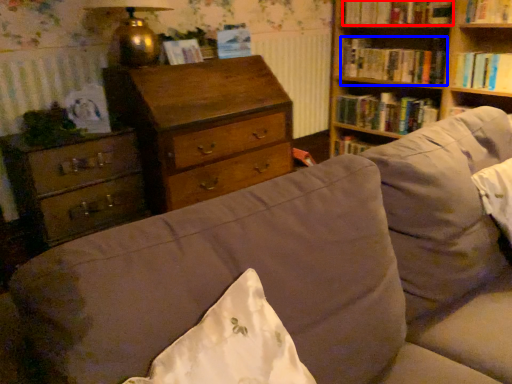
Question: Which point is further to the camera, book (highlighted by a red box) or book (highlighted by a blue box)?

Choices:
 (A) book
 (B) book

Answer: (B)